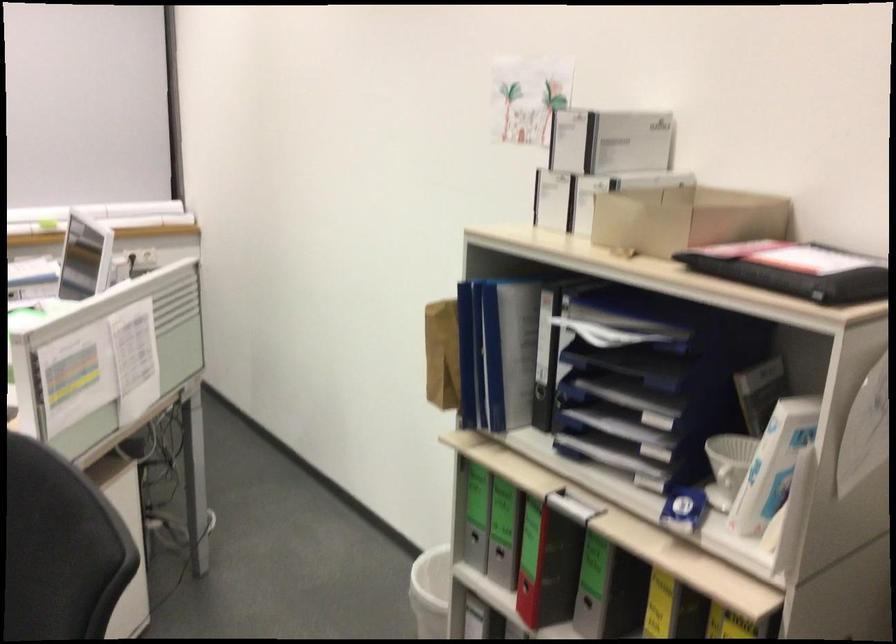
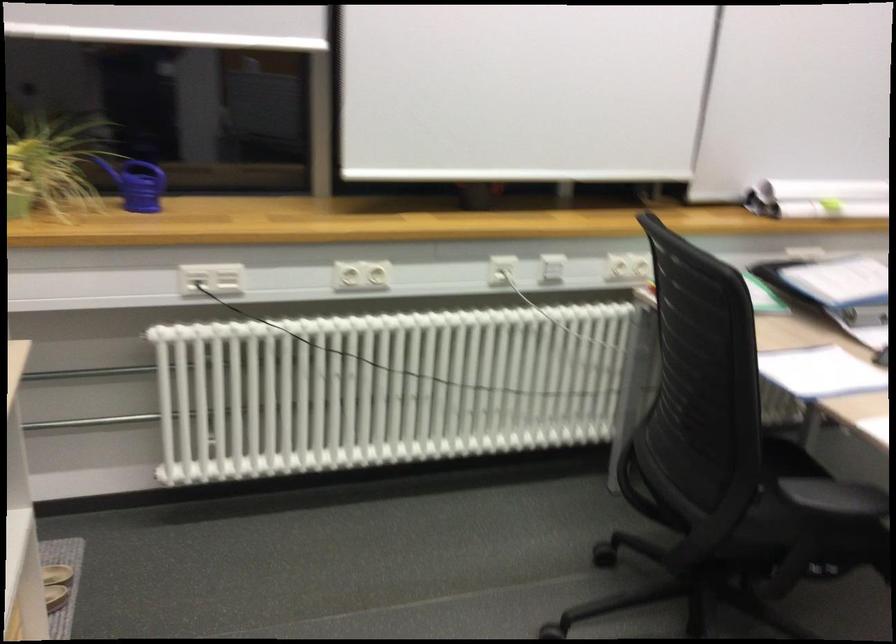
In a continuous first-person perspective shot, in which direction is the camera moving?

The movement direction of the cameraman is left, forward.